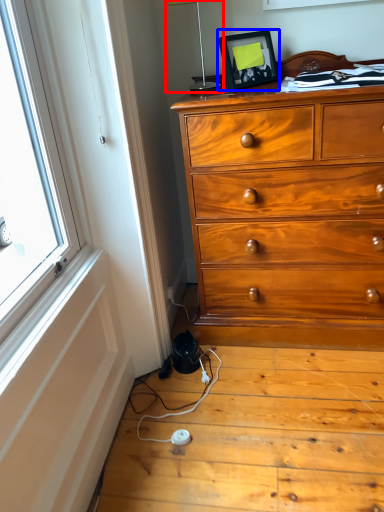
Question: Among these objects, which one is farthest to the camera, table lamp (highlighted by a red box) or picture frame (highlighted by a blue box)?

Choices:
 (A) table lamp
 (B) picture frame

Answer: (B)